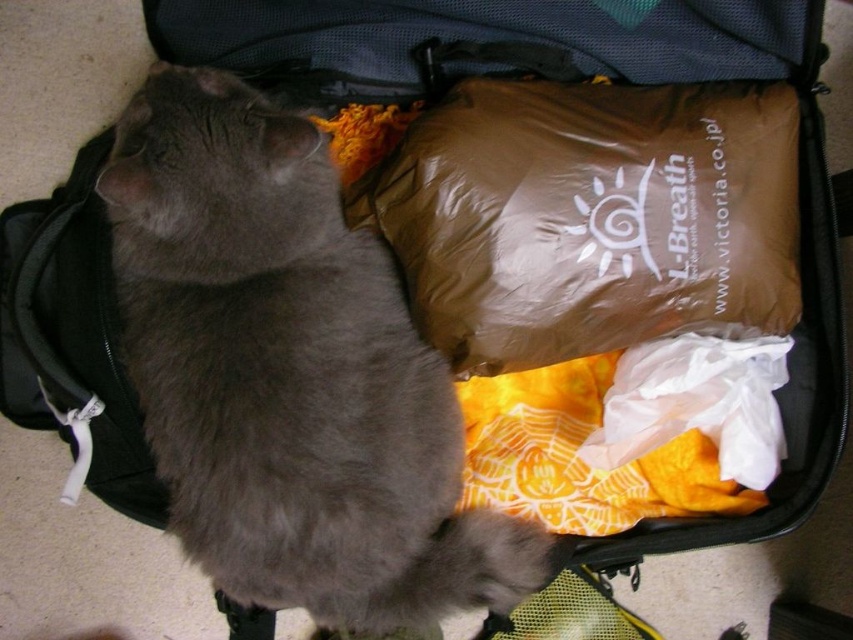
You are standing in front of the open suitcase and want to place a small item in the closest point to you. Which point should you choose between point 1 at (180, 481) and point 2 at (589, 353)?

You should choose point 1 at (180, 481) because it is closer to you than point 2 at (589, 353).

You are packing for a trip and need to place the gray fur cat at center and the brown matte sleeping bag at center into a suitcase. Given that the distance between them in the image is 23.30 centimeters, can you estimate whether they will fit together in the suitcase without overlapping?

The gray fur cat at center and the brown matte sleeping bag at center are 23.30 centimeters apart, so they can fit together in the suitcase without overlapping as long as there is enough space to accommodate both items with that separation distance.

Based on the photo, you are a delivery person who needs to ensure the gray fur cat at center is safely inside the open suitcase. Based on the cat being 35.80 inches from the camera, can you confirm if the cat is entirely within the suitcase?

The gray fur cat at center is 35.80 inches from the camera, so it is positioned inside the open suitcase and entirely within it.